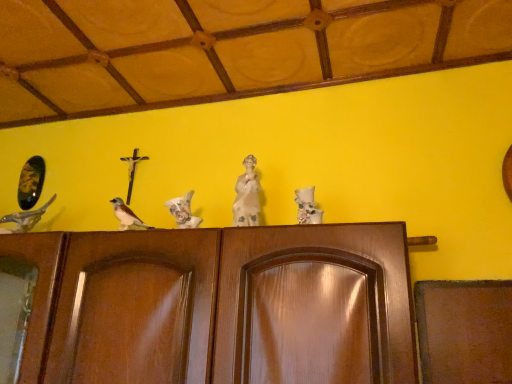
Question: Does point (198, 218) appear closer or farther from the camera than point (256, 218)?

Choices:
 (A) farther
 (B) closer

Answer: (A)

Question: Considering the relative positions of white matte bird at center, which ranks as the 1th bird in right-to-left order, and white porcelain statue at center in the image provided, is white matte bird at center, which ranks as the 1th bird in right-to-left order, to the left or to the right of white porcelain statue at center?

Choices:
 (A) right
 (B) left

Answer: (B)

Question: Estimate the real-world distances between objects in this image. Which object is closer to the shiny metallic bird at left, the third bird from the right?

Choices:
 (A) white porcelain statue at center
 (B) brown matte bird at center, the second bird from the right
 (C) white matte bird at center, which ranks as the 1th bird in right-to-left order

Answer: (B)

Question: Which of these objects is positioned closest to the white matte bird at center, which ranks as the 1th bird in right-to-left order?

Choices:
 (A) shiny metallic bird at left, which is the first bird from left to right
 (B) brown matte bird at center, the second bird from the right
 (C) white porcelain statue at center

Answer: (B)